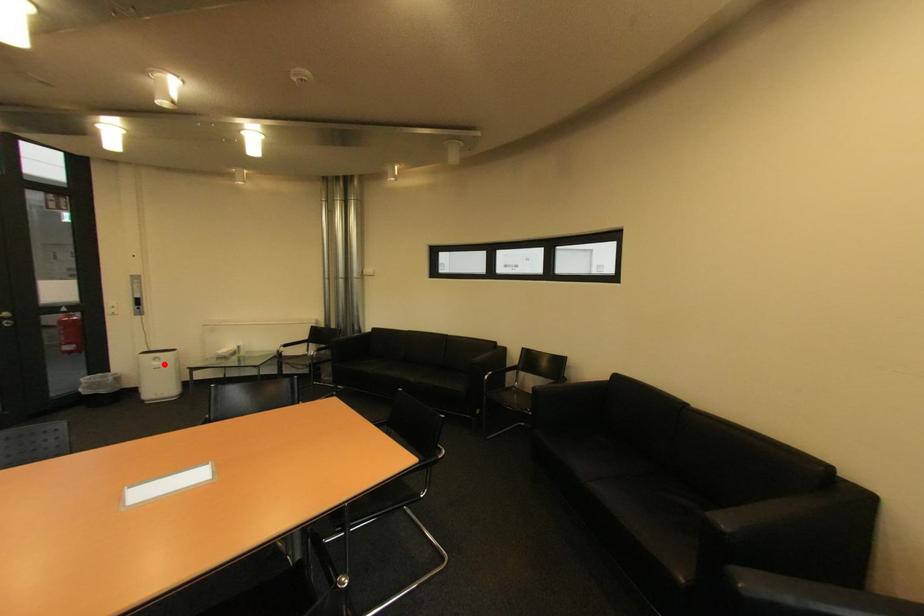
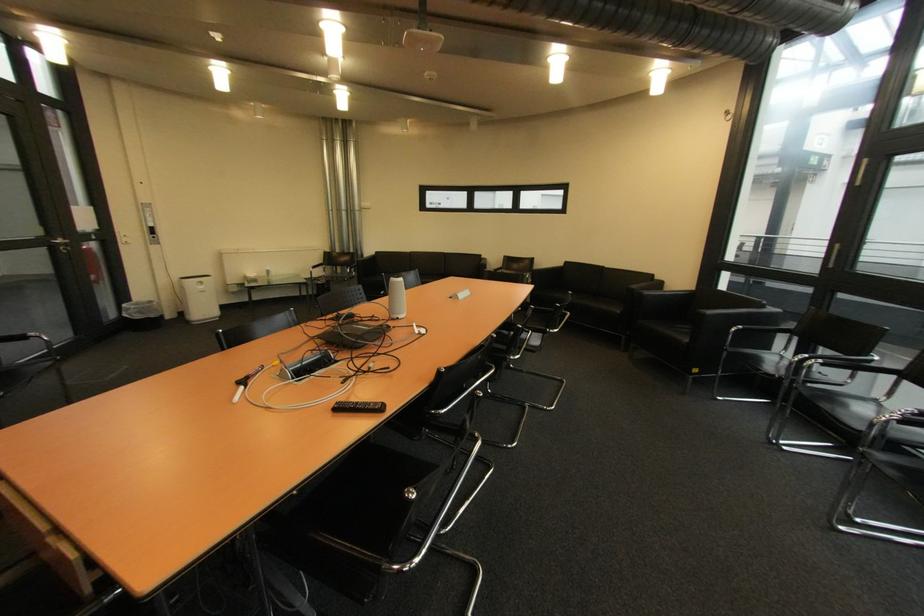
Question: A red point is marked in image1. In image2, is the corresponding 3D point closer to the camera or farther? Reply with the corresponding letter.

Choices:
 (A) The corresponding 3D point is closer.
 (B) The corresponding 3D point is farther.

Answer: (A)